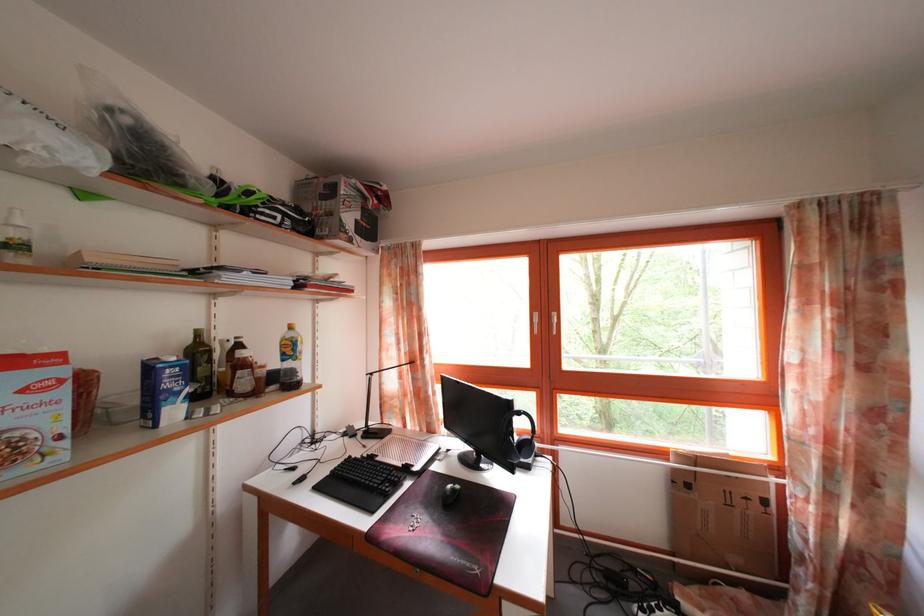
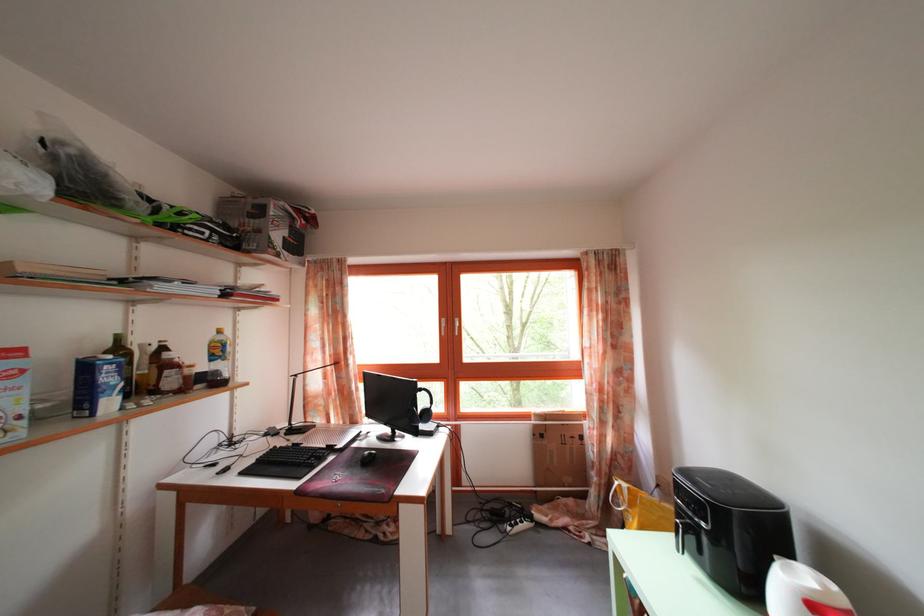
The point at [443,474] is marked in the first image. Where is the corresponding point in the second image?

(363, 451)